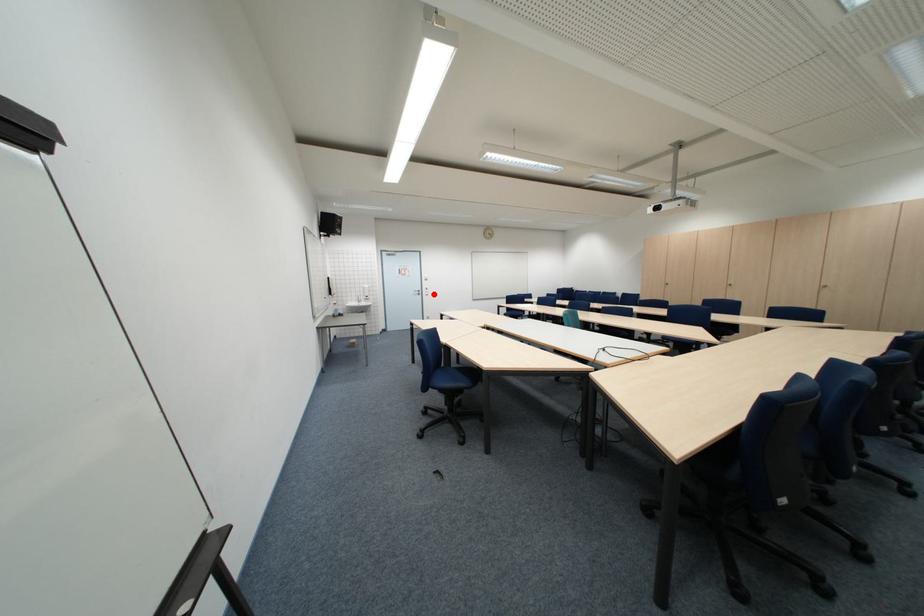
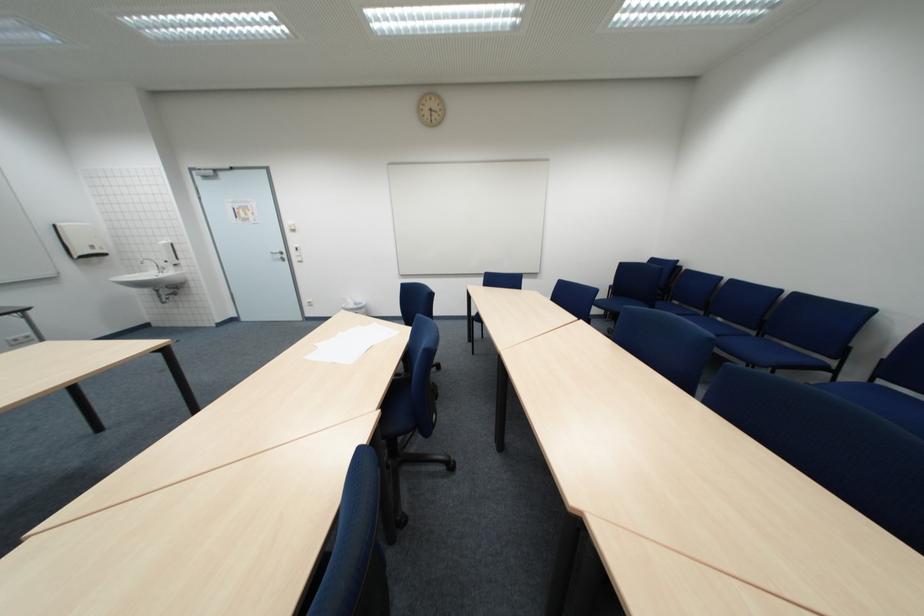
In the second image, find the point that corresponds to the highlighted location in the first image.

(299, 257)